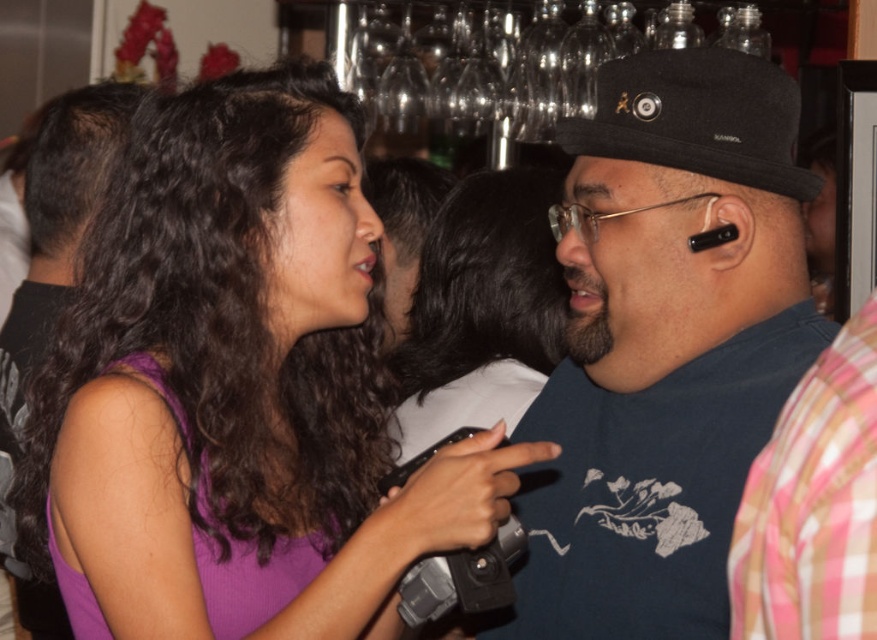
Question: Is purple matte tank top at center wider than dark blue t-shirt at center?

Choices:
 (A) no
 (B) yes

Answer: (B)

Question: Which object appears closest to the camera in this image?

Choices:
 (A) dark blue t-shirt at center
 (B) purple fabric dress at left

Answer: (A)

Question: Does black fabric baseball hat at upper right appear on the left side of purple fabric dress at left?

Choices:
 (A) no
 (B) yes

Answer: (A)

Question: Observing the image, what is the correct spatial positioning of purple matte tank top at center in reference to purple fabric dress at left?

Choices:
 (A) above
 (B) below

Answer: (B)

Question: Which point is farther from the camera taking this photo?

Choices:
 (A) (159, 528)
 (B) (715, 339)
 (C) (643, 122)

Answer: (B)

Question: Which point is closer to the camera taking this photo?

Choices:
 (A) (662, 93)
 (B) (283, 134)

Answer: (B)